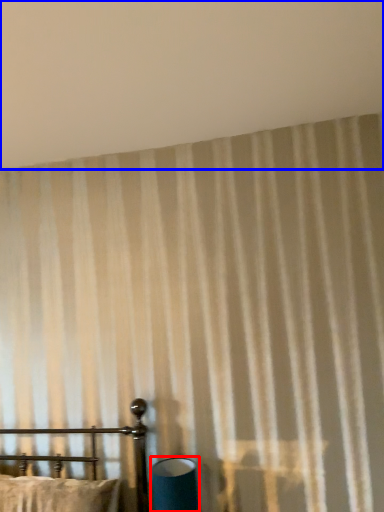
Question: Which object is closer to the camera taking this photo, table lamp (highlighted by a red box) or backdrop (highlighted by a blue box)?

Choices:
 (A) table lamp
 (B) backdrop

Answer: (B)